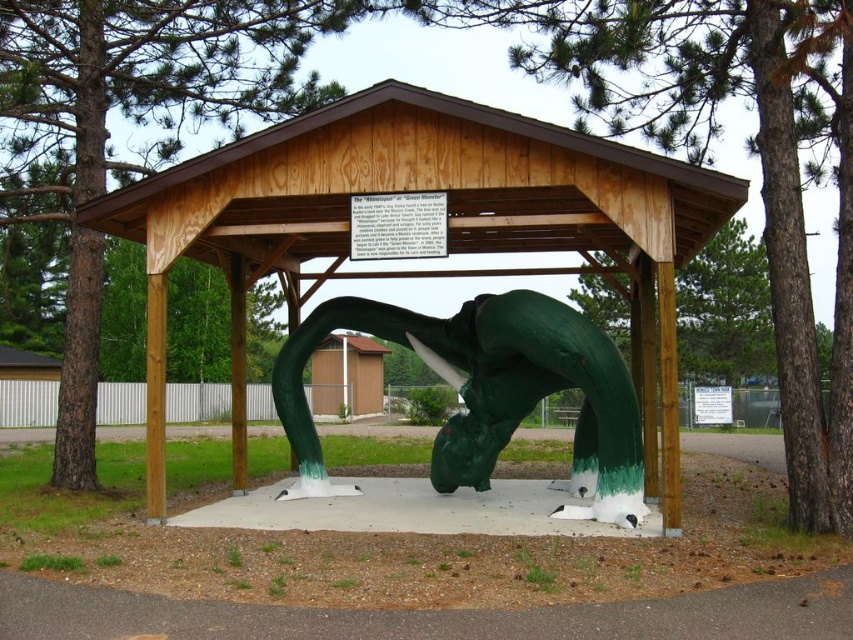
Which of these two, green painted wood gazebo at center or green matte tree trunk at center, stands taller?

green matte tree trunk at center

Measure the distance between point (x=263, y=257) and camera.

Point (x=263, y=257) is 38.95 feet from camera.

Image resolution: width=853 pixels, height=640 pixels. I want to click on green painted wood gazebo at center, so click(419, 189).

Is point (718, 221) positioned behind point (596, 355)?

That is True.

What do you see at coordinates (419, 189) in the screenshot?
I see `green painted wood gazebo at center` at bounding box center [419, 189].

Is point (302, 179) more distant than point (610, 493)?

That is False.

Identify the location of green painted wood gazebo at center. The width and height of the screenshot is (853, 640). (419, 189).

Consider the image. Is green matte tree trunk at center bigger than green matte whale at center?

No, green matte tree trunk at center is not bigger than green matte whale at center.

Between green matte tree trunk at center and green matte whale at center, which one has less height?

With less height is green matte tree trunk at center.

You are a GUI agent. You are given a task and a screenshot of the screen. Output one action in this format:
    pyautogui.click(x=<x>, y=<y>)
    Task: Click on the green matte tree trunk at center
    
    Given the screenshot: What is the action you would take?
    pyautogui.click(x=132, y=122)

Locate an element on the screen. The width and height of the screenshot is (853, 640). green matte tree trunk at center is located at coordinates (132, 122).